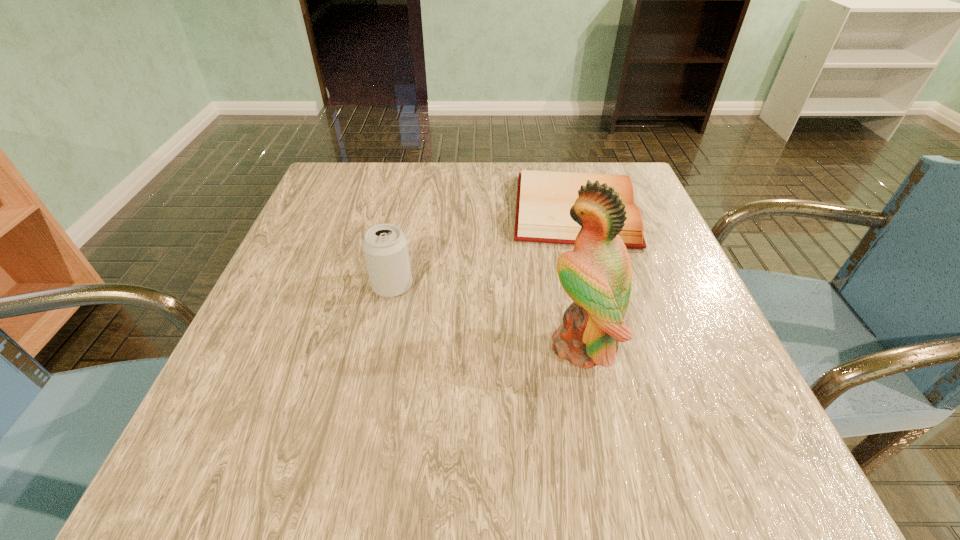
Where is `vacant region that satisfies the following two spatial constraints: 1. on the front side of the Bible; 2. on the front-facing side of the tallest object`? This screenshot has height=540, width=960. vacant region that satisfies the following two spatial constraints: 1. on the front side of the Bible; 2. on the front-facing side of the tallest object is located at coordinates (612, 345).

This screenshot has width=960, height=540. I want to click on vacant space that satisfies the following two spatial constraints: 1. on the back side of the farthest object; 2. on the left side of the second nearest object, so click(408, 210).

I want to click on vacant space that satisfies the following two spatial constraints: 1. on the front side of the shortest object; 2. on the front-facing side of the parrot, so click(x=612, y=345).

Where is `blank space that satisfies the following two spatial constraints: 1. on the front side of the shortest object; 2. on the front-facing side of the nearest object`? Image resolution: width=960 pixels, height=540 pixels. blank space that satisfies the following two spatial constraints: 1. on the front side of the shortest object; 2. on the front-facing side of the nearest object is located at coordinates (612, 345).